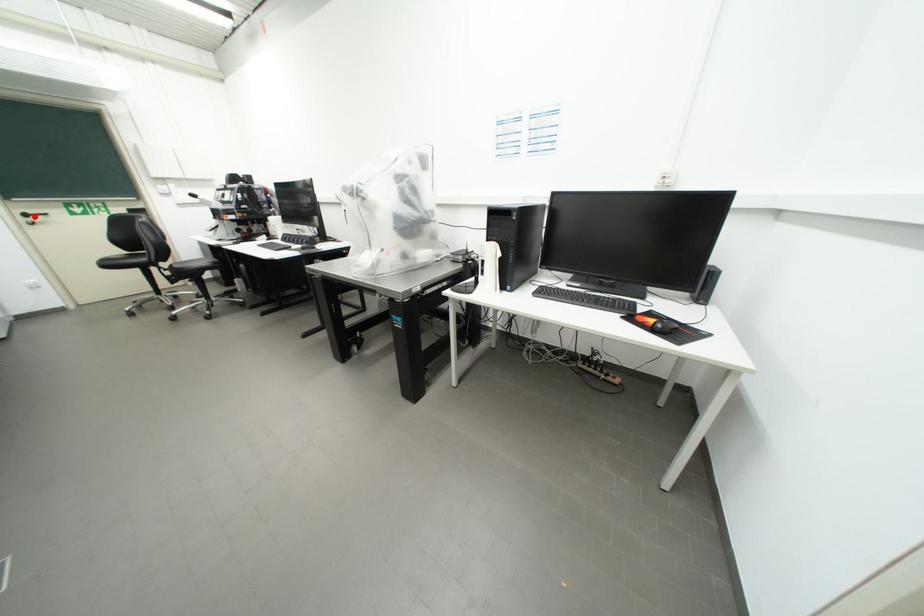
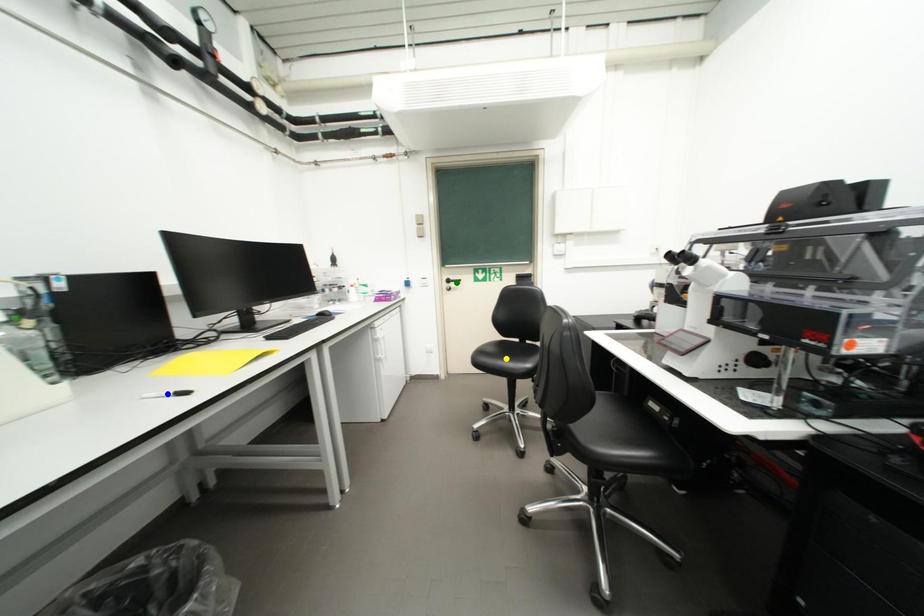
Question: I am providing you with two images of the same scene from different viewpoints. A red point is marked on the first image. You are given multiple points on the second image. Which mark in image 2 goes with the point in image 1?

Choices:
 (A) blue point
 (B) yellow point
 (C) green point

Answer: (C)